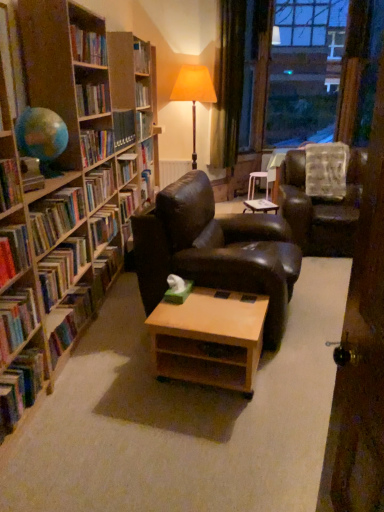
Question: Is green velvet curtain at upper right touching transparent glass window at upper right?

Choices:
 (A) no
 (B) yes

Answer: (A)

Question: From a real-world perspective, is green velvet curtain at upper right on transparent glass window at upper right?

Choices:
 (A) yes
 (B) no

Answer: (B)

Question: Is transparent glass window at upper right at the back of green velvet curtain at upper right?

Choices:
 (A) no
 (B) yes

Answer: (A)

Question: Is green velvet curtain at upper right completely or partially outside of transparent glass window at upper right?

Choices:
 (A) yes
 (B) no

Answer: (A)

Question: Considering the relative sizes of green velvet curtain at upper right and transparent glass window at upper right in the image provided, is green velvet curtain at upper right taller than transparent glass window at upper right?

Choices:
 (A) no
 (B) yes

Answer: (A)

Question: From the image's perspective, would you say green velvet curtain at upper right is shown under transparent glass window at upper right?

Choices:
 (A) no
 (B) yes

Answer: (B)

Question: Considering the relative sizes of hardcover books at left, marked as the 4th book in a bottom-to-top arrangement, and wooden bookshelf at left, the eighth book when ordered from bottom to top, in the image provided, is hardcover books at left, marked as the 4th book in a bottom-to-top arrangement, shorter than wooden bookshelf at left, the eighth book when ordered from bottom to top,?

Choices:
 (A) yes
 (B) no

Answer: (A)

Question: From the image's perspective, is hardcover books at left, marked as the 4th book in a bottom-to-top arrangement, located beneath wooden bookshelf at left, the 1th book when ordered from top to bottom?

Choices:
 (A) yes
 (B) no

Answer: (A)

Question: From a real-world perspective, is hardcover books at left, marked as the 5th book in a top-to-bottom arrangement, on wooden bookshelf at left, the eighth book when ordered from bottom to top?

Choices:
 (A) yes
 (B) no

Answer: (B)

Question: Can you see hardcover books at left, marked as the 5th book in a top-to-bottom arrangement, touching wooden bookshelf at left, the 1th book when ordered from top to bottom?

Choices:
 (A) no
 (B) yes

Answer: (A)

Question: From a real-world perspective, does hardcover books at left, marked as the 4th book in a bottom-to-top arrangement, sit lower than wooden bookshelf at left, the 1th book when ordered from top to bottom?

Choices:
 (A) yes
 (B) no

Answer: (A)

Question: Is hardcover books at left, marked as the 4th book in a bottom-to-top arrangement, not inside wooden bookshelf at left, the 1th book when ordered from top to bottom?

Choices:
 (A) no
 (B) yes

Answer: (A)

Question: Does hardcover book at left, arranged as the third book when ordered from the bottom, have a greater width compared to hardcover books at left, marked as the 5th book in a top-to-bottom arrangement?

Choices:
 (A) yes
 (B) no

Answer: (B)